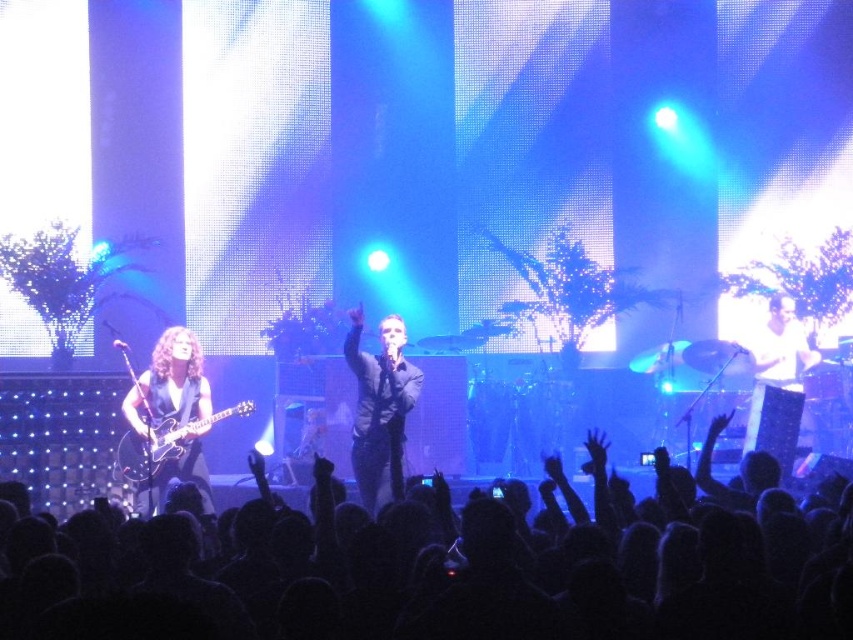
Does black matte suit at center have a lesser width compared to shiny black guitar at left?

Correct, black matte suit at center's width is less than shiny black guitar at left's.

Does black matte suit at center come in front of shiny black guitar at left?

Yes, black matte suit at center is in front of shiny black guitar at left.

Find the location of a particular element. The image size is (853, 640). black matte suit at center is located at coordinates (378, 403).

Does black fabric crowd at center appear over black matte suit at center?

No, black fabric crowd at center is not above black matte suit at center.

Is point (45, 548) farther from viewer compared to point (392, 406)?

No.

Find the location of a particular element. This screenshot has width=853, height=640. black fabric crowd at center is located at coordinates (437, 570).

Between black fabric crowd at center and shiny black guitar at left, which one has less height?

With less height is black fabric crowd at center.

Between black fabric crowd at center and shiny black guitar at left, which one has more height?

shiny black guitar at left

Measure the distance between black fabric crowd at center and camera.

They are 10.62 feet apart.

Identify the location of black fabric crowd at center. (437, 570).